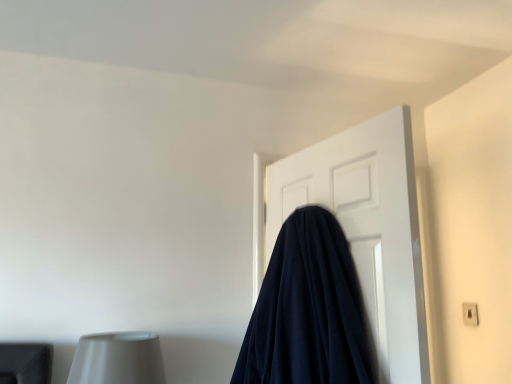
Identify the location of white plastic electric outlet at upper right. The height and width of the screenshot is (384, 512). (470, 314).

The height and width of the screenshot is (384, 512). Describe the element at coordinates (367, 228) in the screenshot. I see `navy blue fabric at center` at that location.

I want to click on navy blue fabric at center, so click(309, 311).

Considering the relative positions of white plastic electric outlet at upper right and navy blue fabric at center in the image provided, is white plastic electric outlet at upper right behind navy blue fabric at center?

Yes, white plastic electric outlet at upper right is further from the camera.

Does white plastic electric outlet at upper right have a larger size compared to navy blue fabric at center?

No, white plastic electric outlet at upper right is not bigger than navy blue fabric at center.

Considering the points (474, 307) and (381, 277), which point is behind, point (474, 307) or point (381, 277)?

Point (474, 307)

From a real-world perspective, is navy blue fabric at center positioned above or below navy blue fabric at center?

navy blue fabric at center is above navy blue fabric at center.

Looking at this image, is navy blue fabric at center next to navy blue fabric at center?

No, navy blue fabric at center is not next to navy blue fabric at center.

Can navy blue fabric at center be found inside navy blue fabric at center?

That's incorrect, navy blue fabric at center is not inside navy blue fabric at center.

From the picture: From their relative heights in the image, would you say navy blue fabric at center is taller or shorter than navy blue fabric at center?

In the image, navy blue fabric at center appears to be taller than navy blue fabric at center.

The width and height of the screenshot is (512, 384). I want to click on blanket directly beneath the navy blue fabric at center (from a real-world perspective), so click(x=309, y=311).

Based on the photo, can you tell me how much navy blue fabric at center and navy blue fabric at center differ in facing direction?

The angular difference between navy blue fabric at center and navy blue fabric at center is 179 degrees.

Are navy blue fabric at center and navy blue fabric at center beside each other?

They are not placed beside each other.

Does navy blue fabric at center turn towards navy blue fabric at center?

Yes, navy blue fabric at center is facing navy blue fabric at center.

Is white plastic electric outlet at upper right surrounded by navy blue fabric at center?

No, white plastic electric outlet at upper right is not surrounded by navy blue fabric at center.

Considering the relative sizes of navy blue fabric at center and white plastic electric outlet at upper right in the image provided, is navy blue fabric at center smaller than white plastic electric outlet at upper right?

Actually, navy blue fabric at center might be larger than white plastic electric outlet at upper right.

Considering the sizes of objects navy blue fabric at center and white plastic electric outlet at upper right in the image provided, who is shorter, navy blue fabric at center or white plastic electric outlet at upper right?

white plastic electric outlet at upper right.

Which is closer to the camera, (476, 304) or (277, 370)?

Point (476, 304).

Is white plastic electric outlet at upper right shorter than navy blue fabric at center?

Yes, white plastic electric outlet at upper right is shorter than navy blue fabric at center.

Is white plastic electric outlet at upper right facing away from navy blue fabric at center?

That's not correct — white plastic electric outlet at upper right is not looking away from navy blue fabric at center.

Is navy blue fabric at center facing towards white plastic electric outlet at upper right?

Yes, navy blue fabric at center is facing white plastic electric outlet at upper right.

How many degrees apart are the facing directions of navy blue fabric at center and white plastic electric outlet at upper right?

The angle between the facing direction of navy blue fabric at center and the facing direction of white plastic electric outlet at upper right is 164 degrees.

From a real-world perspective, who is located lower, navy blue fabric at center or white plastic electric outlet at upper right?

white plastic electric outlet at upper right.

Is navy blue fabric at center far away from white plastic electric outlet at upper right?

No, navy blue fabric at center is not far from white plastic electric outlet at upper right.

What are the coordinates of `electric outlet lying behind the navy blue fabric at center` in the screenshot? It's located at (470, 314).

The image size is (512, 384). Find the location of `blanket below the navy blue fabric at center (from a real-world perspective)`. blanket below the navy blue fabric at center (from a real-world perspective) is located at coordinates (309, 311).

Estimate the real-world distances between objects in this image. Which object is further from navy blue fabric at center, navy blue fabric at center or white plastic electric outlet at upper right?

white plastic electric outlet at upper right lies further to navy blue fabric at center than the other object.

When comparing their distances from white plastic electric outlet at upper right, does navy blue fabric at center or navy blue fabric at center seem further?

navy blue fabric at center is further to white plastic electric outlet at upper right.

Which object lies further to the anchor point navy blue fabric at center, white plastic electric outlet at upper right or navy blue fabric at center?

white plastic electric outlet at upper right is further to navy blue fabric at center.

When comparing their distances from navy blue fabric at center, does white plastic electric outlet at upper right or navy blue fabric at center seem further?

The object further to navy blue fabric at center is white plastic electric outlet at upper right.

Based on their spatial positions, is navy blue fabric at center or navy blue fabric at center further from white plastic electric outlet at upper right?

Based on the image, navy blue fabric at center appears to be further to white plastic electric outlet at upper right.

Looking at the image, which one is located closer to navy blue fabric at center, navy blue fabric at center or white plastic electric outlet at upper right?

navy blue fabric at center.

Locate an element on the screen. The height and width of the screenshot is (384, 512). door positioned between navy blue fabric at center and white plastic electric outlet at upper right from near to far is located at coordinates (367, 228).